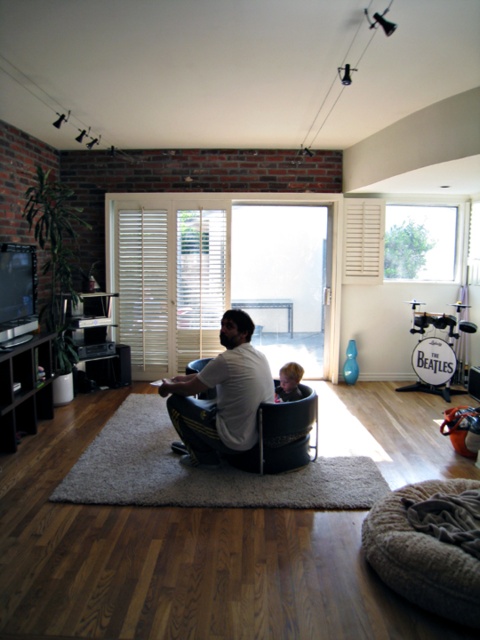
Question: Based on their relative distances, which object is nearer to the white cotton shirt at center?

Choices:
 (A) smooth brown hair at lower center
 (B) beige textured bean bag at lower right

Answer: (A)

Question: Does white cotton shirt at center appear on the left side of smooth brown hair at lower center?

Choices:
 (A) yes
 (B) no

Answer: (A)

Question: Which point is farther from the camera taking this photo?

Choices:
 (A) coord(236,412)
 (B) coord(406,586)

Answer: (A)

Question: Does beige textured bean bag at lower right appear on the left side of smooth brown hair at lower center?

Choices:
 (A) no
 (B) yes

Answer: (A)

Question: Does white cotton shirt at center appear under smooth brown hair at lower center?

Choices:
 (A) no
 (B) yes

Answer: (B)

Question: Among these objects, which one is nearest to the camera?

Choices:
 (A) smooth brown hair at lower center
 (B) white cotton shirt at center

Answer: (B)